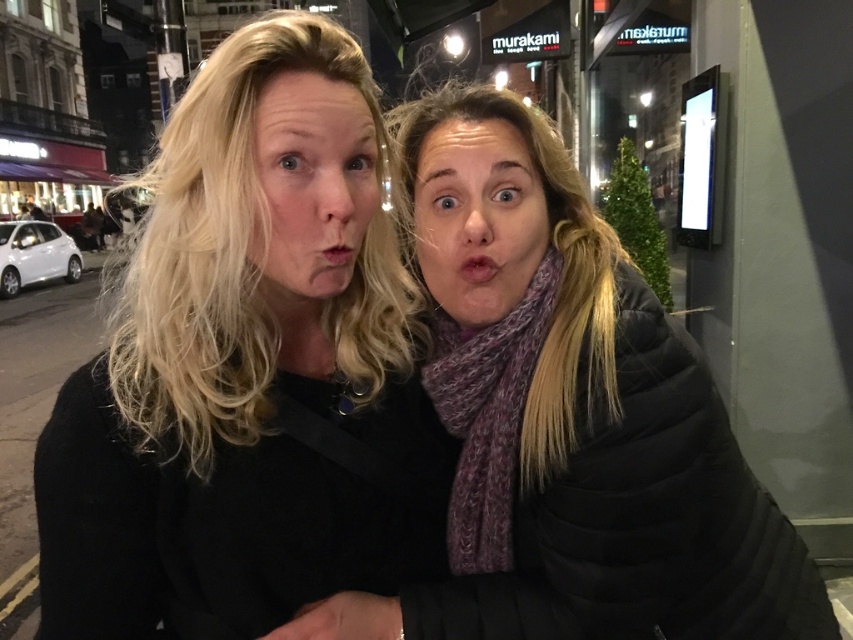
Question: Does matte black face at center appear on the left side of purple scarf at center?

Choices:
 (A) yes
 (B) no

Answer: (A)

Question: Among these objects, which one is farthest from the camera?

Choices:
 (A) matte black jacket at left
 (B) matte black face at center

Answer: (A)

Question: Estimate the real-world distances between objects in this image. Which object is closer to the purple scarf at center?

Choices:
 (A) matte black face at center
 (B) matte black jacket at left

Answer: (B)

Question: Is matte black jacket at left to the right of purple scarf at center from the viewer's perspective?

Choices:
 (A) no
 (B) yes

Answer: (A)

Question: Which point appears closest to the camera in this image?

Choices:
 (A) (479, 284)
 (B) (276, 179)

Answer: (B)

Question: Is matte black jacket at left in front of matte black face at center?

Choices:
 (A) no
 (B) yes

Answer: (A)